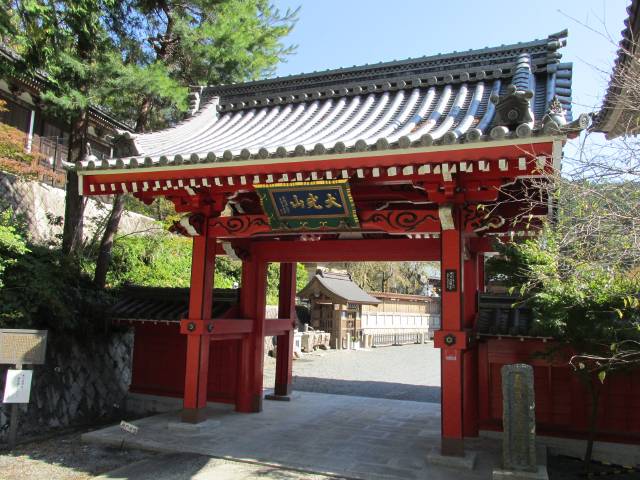
This screenshot has width=640, height=480. What are the coordinates of `entryway` in the screenshot? It's located at pos(342,253).